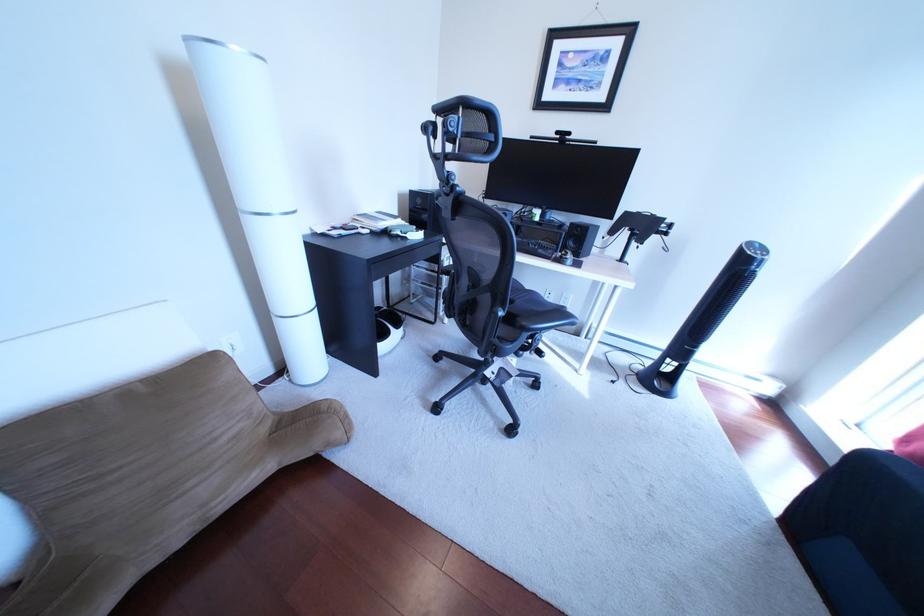
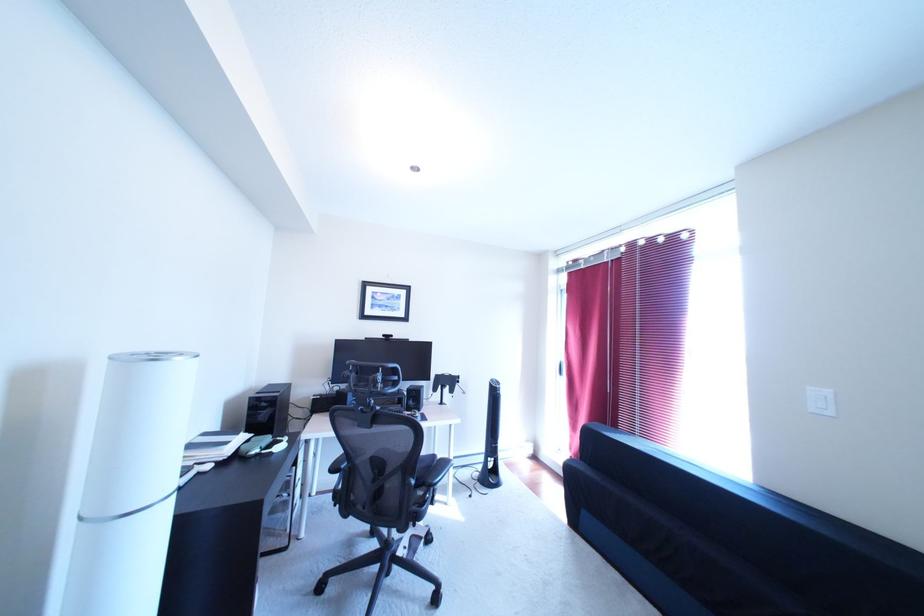
First-person continuous shooting, in which direction is the camera rotating?

The camera rotated toward right-up.